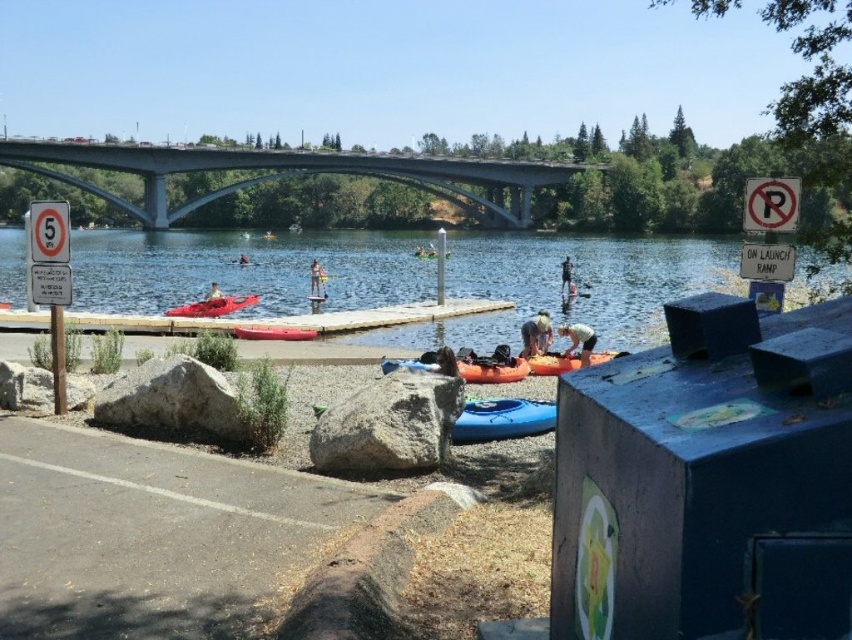
You are standing at the parking area and want to take a photo of the kayaks and canoes on the shore. You notice two points marked as point 1 at coordinates (258, 243) and point 2 at coordinates (246, 262). Which point should you focus on to ensure the kayaks and canoes are in sharp focus if you want to capture them clearly from your current position?

You should focus on point 1 at coordinates (258, 243) because it is closer to the camera than point 2 at coordinates (246, 262), ensuring the kayaks and canoes in the foreground will be in sharp focus.

You are a photographer at the lakeside and want to capture a clear shot of the light brown hair at lower center without the red plastic paddle at center blocking it. How should you adjust your camera angle?

The light brown hair at lower center is positioned under the red plastic paddle at center. To avoid the paddle blocking the shot, you can tilt your camera upwards to focus on the light brown hair at lower center while moving the paddle out of the frame.

You are standing at the edge of the lake and want to retrieve the red plastic paddle at center. The light brown hair at lower center belongs to a lifeguard. Can you safely walk from your current position to the paddle without getting too close to the lifeguard?

The distance between the light brown hair at lower center and the red plastic paddle at center is 25.55 meters, so yes, you can safely walk to the paddle without getting too close to the lifeguard.